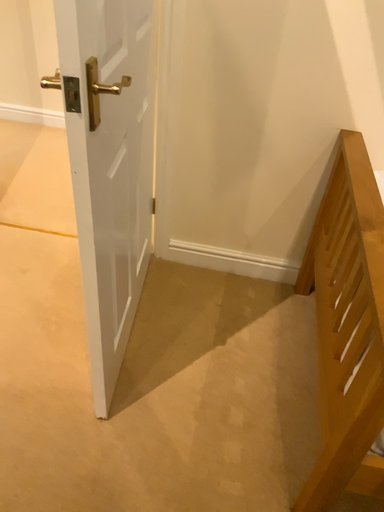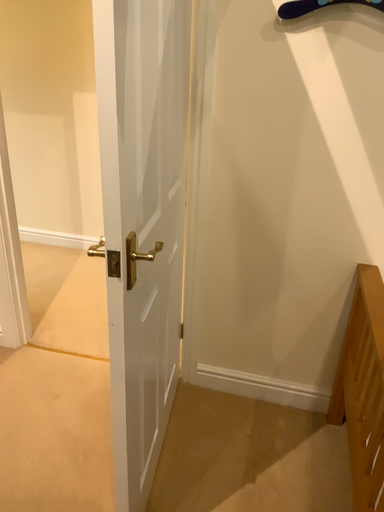
Question: How did the camera likely rotate when shooting the video?

Choices:
 (A) rotated downward
 (B) rotated upward

Answer: (B)